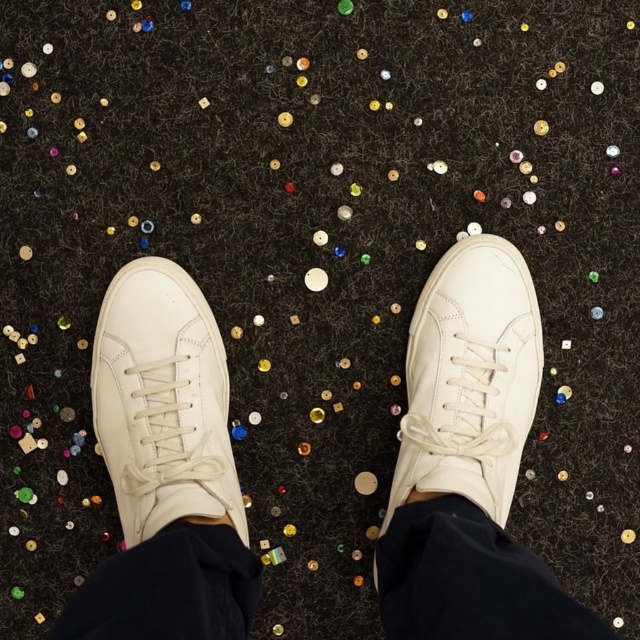
Question: Among these points, which one is farthest from the camera?

Choices:
 (A) (182, 305)
 (B) (157, 449)
 (C) (465, 269)

Answer: (C)

Question: Does white leather sneakers at center have a smaller size compared to white leather sneaker at center?

Choices:
 (A) no
 (B) yes

Answer: (A)

Question: Does white leather sneakers at center have a larger size compared to white leather sneaker at center?

Choices:
 (A) no
 (B) yes

Answer: (B)

Question: Which point is farther to the camera?

Choices:
 (A) white leather sneakers at center
 (B) white leather sneaker at center

Answer: (B)

Question: Can you confirm if white leather sneakers at center is thinner than white leather sneaker at center?

Choices:
 (A) yes
 (B) no

Answer: (B)

Question: Which object is positioned closest to the white leather sneakers at center?

Choices:
 (A) white leather sneaker at center
 (B) white leather sneaker at left

Answer: (A)